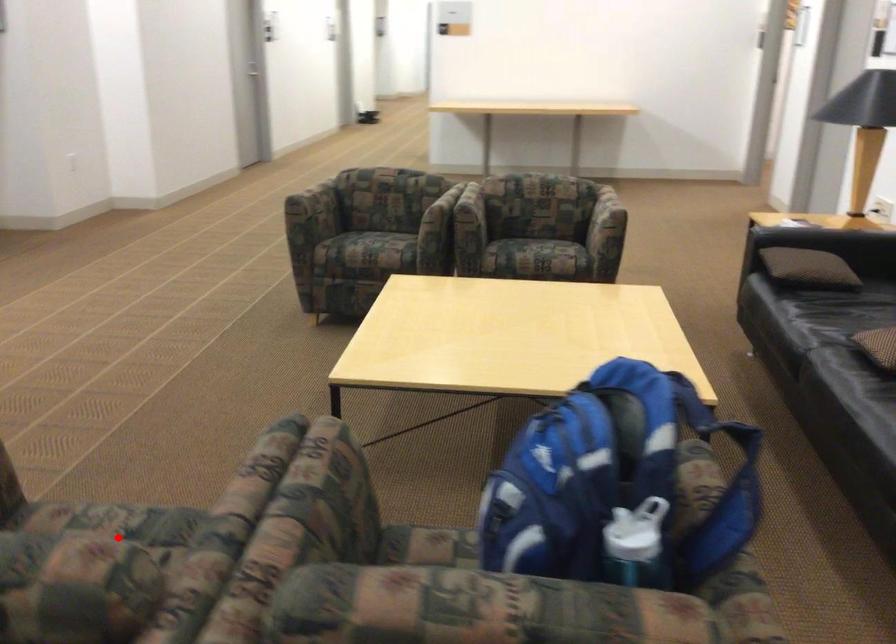
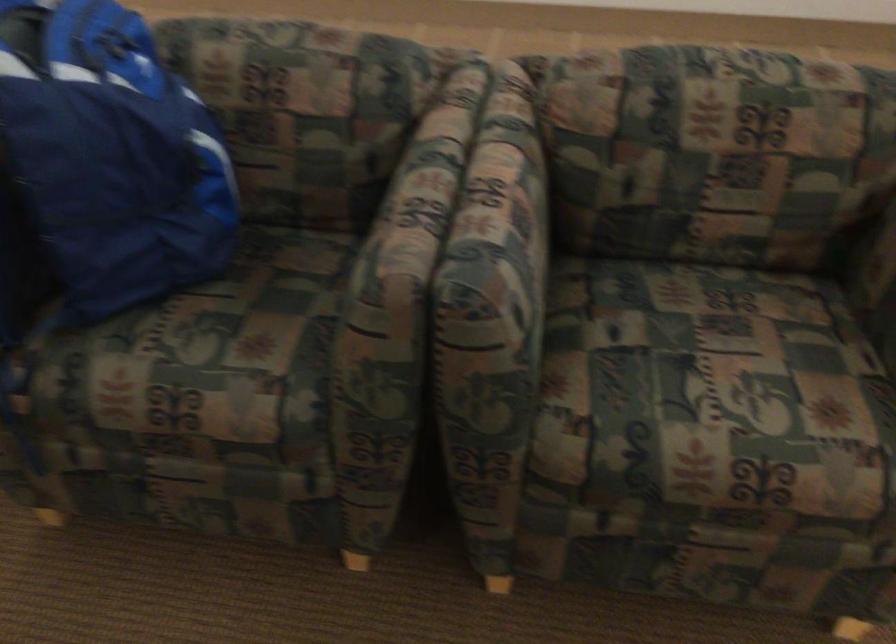
In the second image, find the point that corresponds to the highlighted location in the first image.

(691, 357)